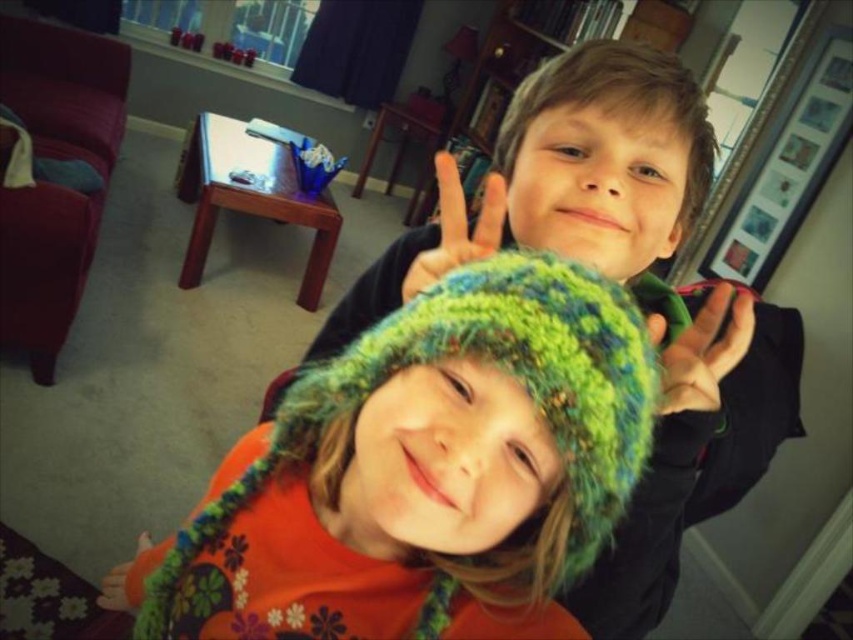
Does knitted green hat at center have a larger size compared to fluffy orange sweater at lower left?

Indeed, knitted green hat at center has a larger size compared to fluffy orange sweater at lower left.

How much distance is there between knitted green hat at center and fluffy orange sweater at lower left?

knitted green hat at center is 20.18 inches from fluffy orange sweater at lower left.

Is point (612, 433) positioned behind point (102, 580)?

No.

Where is `knitted green hat at center`? knitted green hat at center is located at coordinates (424, 472).

Can you confirm if matte green knitted hat at center is shorter than green knitted hat at center?

Incorrect, matte green knitted hat at center's height does not fall short of green knitted hat at center's.

Is point (524, 157) positioned before point (433, 256)?

No, (524, 157) is behind (433, 256).

The width and height of the screenshot is (853, 640). In order to click on matte green knitted hat at center in this screenshot , I will do pyautogui.click(x=567, y=179).

Is matte green knitted hat at center wider than fluffy orange sweater at lower left?

Indeed, matte green knitted hat at center has a greater width compared to fluffy orange sweater at lower left.

Between matte green knitted hat at center and fluffy orange sweater at lower left, which one appears on the right side from the viewer's perspective?

matte green knitted hat at center is more to the right.

Who is more forward, (311, 360) or (123, 600)?

Point (311, 360)

Identify the location of matte green knitted hat at center. (567, 179).